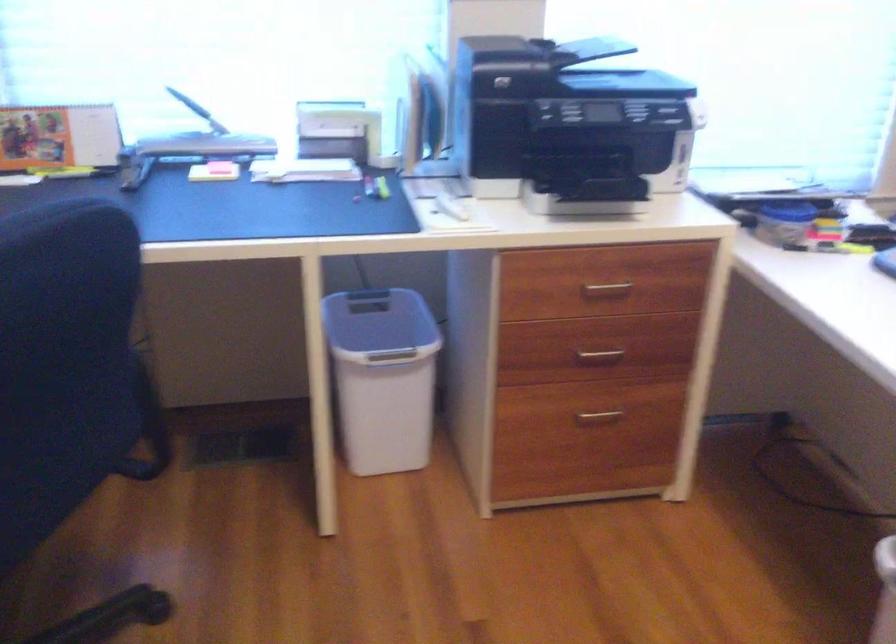
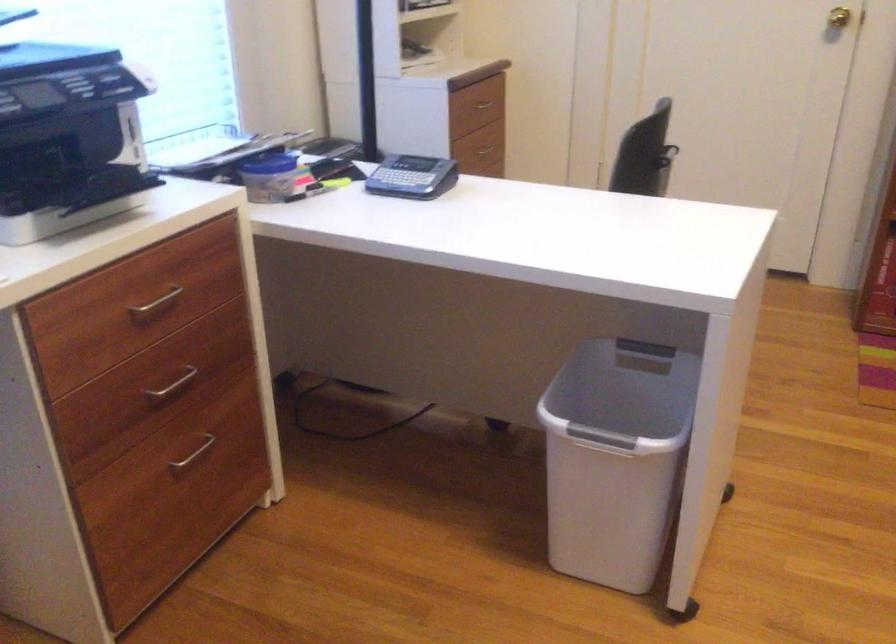
In the second image, find the point that corresponds to point 599,413 in the first image.

(193, 453)